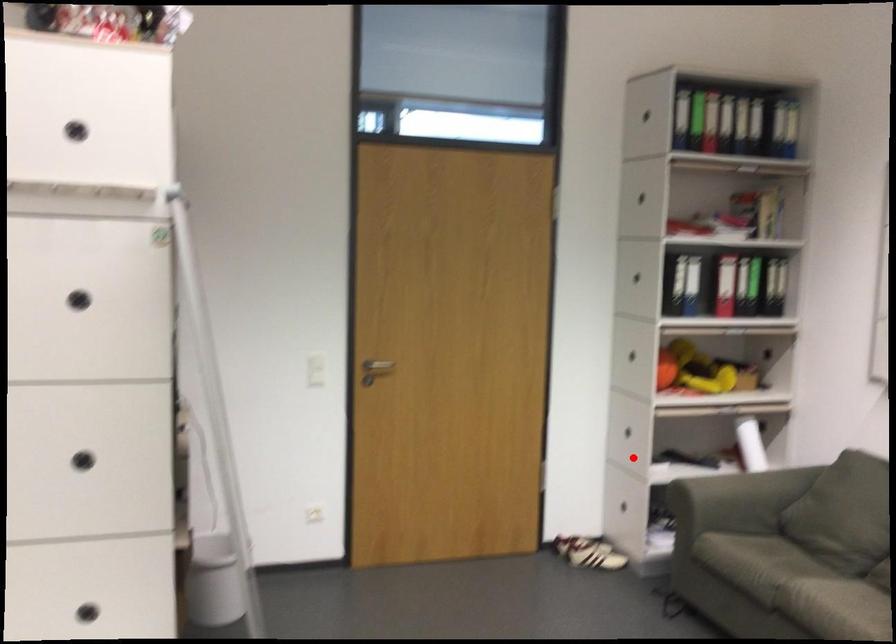
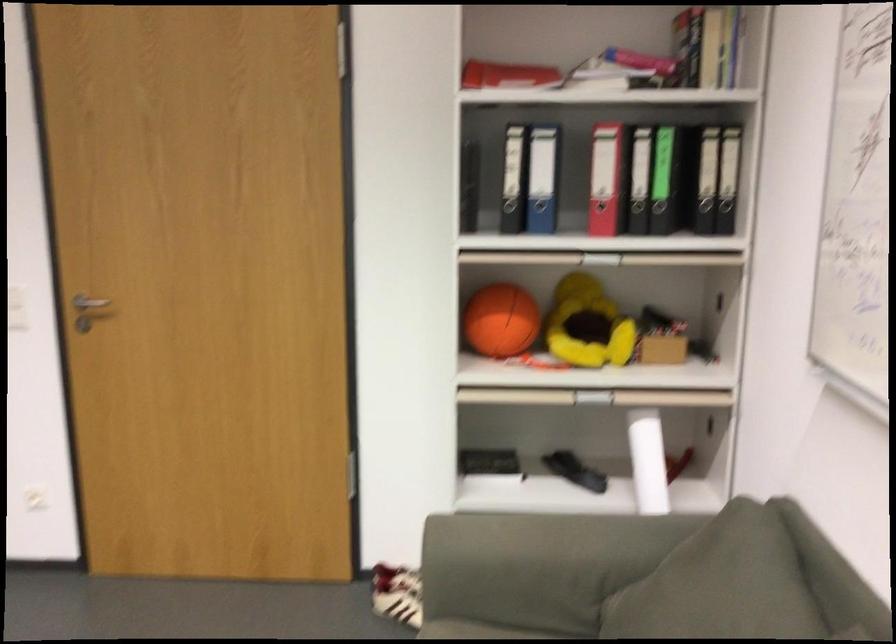
Locate, in the second image, the point that corresponds to the highlighted location in the first image.

(489, 464)